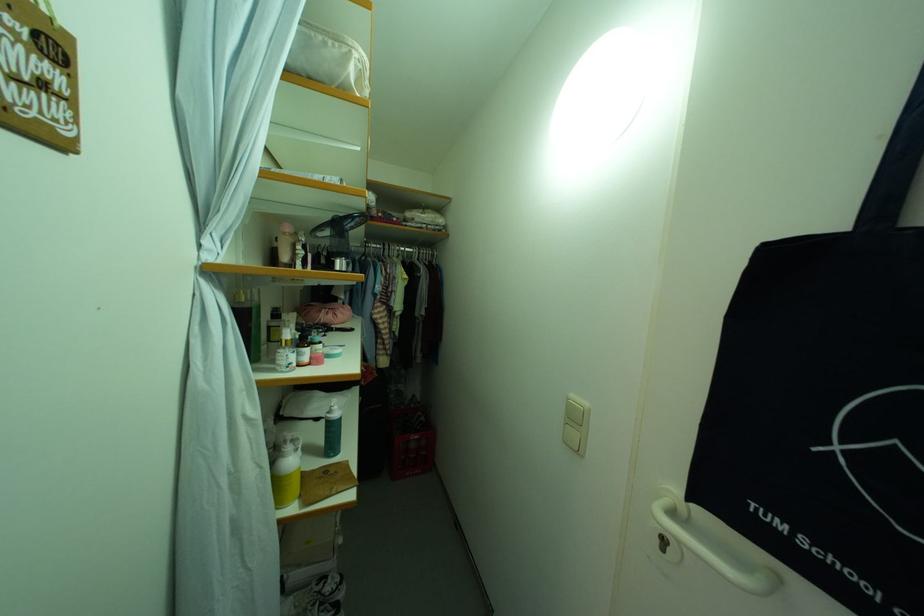
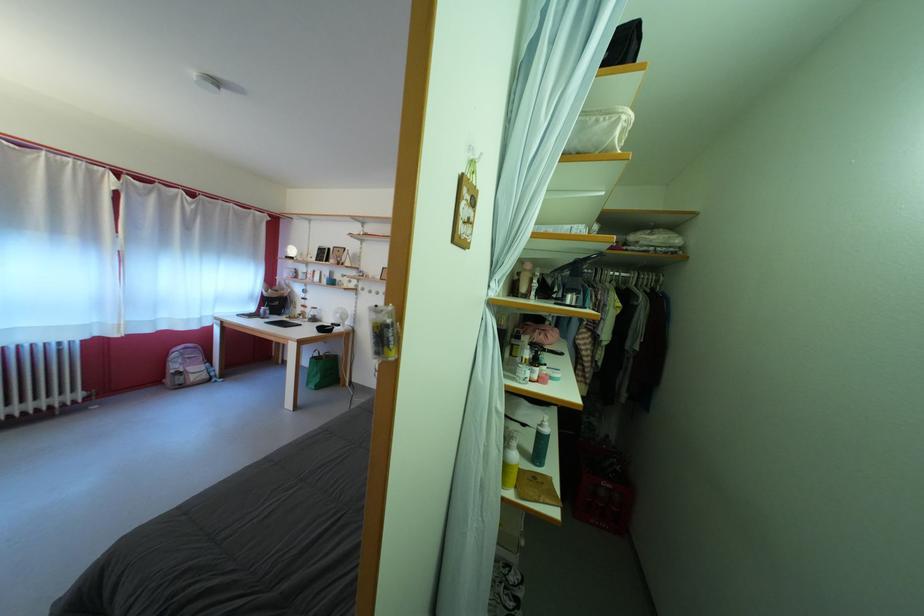
Locate, in the second image, the point that corresponds to pixel 416 256 in the first image.

(631, 281)